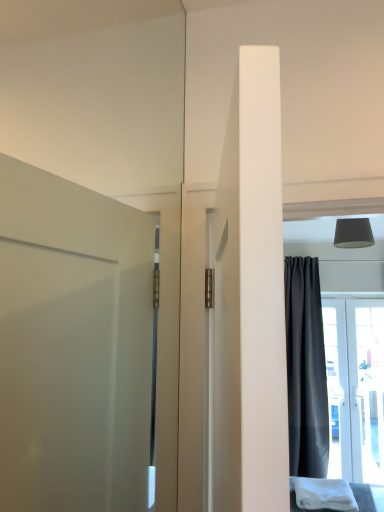
The height and width of the screenshot is (512, 384). I want to click on vacant point above white soft cloth at lower right (from a real-world perspective), so click(x=328, y=487).